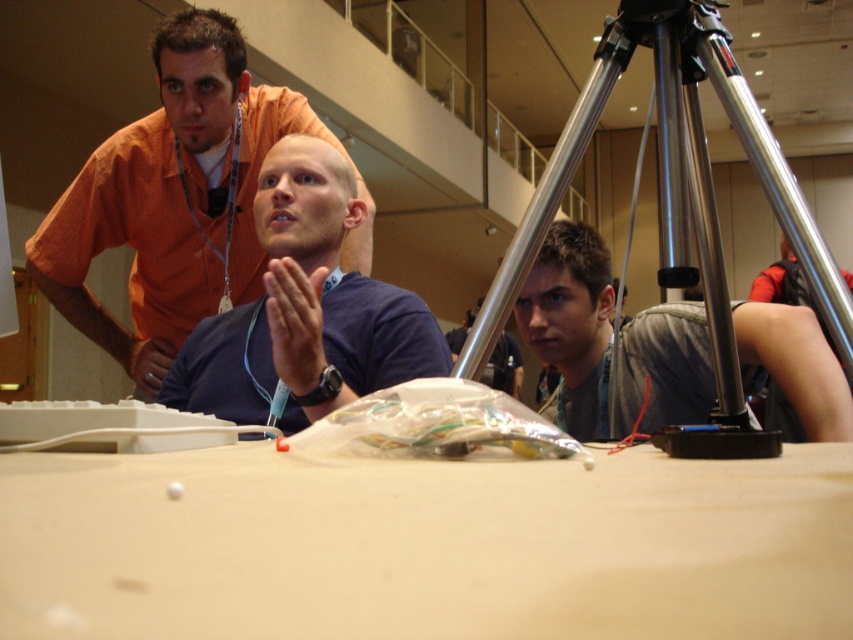
You are a photographer setting up for an event. You need to place a 12cm tall decorative item on the white matte table at center so it can be seen clearly by someone standing next to the gray fabric shirt at right. Is the table tall enough for this purpose?

The white matte table at center is shorter than the gray fabric shirt at right. Since the shirt wearer is standing, the table might be too low for the item to be easily seen. The 12cm tall item may not be visible over the table edge from the shirt wearer

From the picture: You are an event organizer who needs to arrange seating for two speakers. You see the orange shirt at upper left and the gray fabric shirt at right in the image. Which speaker should you seat first if you want to accommodate the wider one closer to the audience?

The orange shirt at upper left is wider than the gray fabric shirt at right, so you should seat the orange shirt at upper left first to place the wider speaker closer to the audience.

You are setting up a camera for a presentation. You have a silver metallic tripod at center and a gray fabric shirt at right. Which object should you avoid placing near the tripod to prevent blocking the camera view?

You should avoid placing the gray fabric shirt at right near the silver metallic tripod at center because the gray fabric shirt at right is narrower than the silver metallic tripod at center, so it might block the camera view if placed nearby.